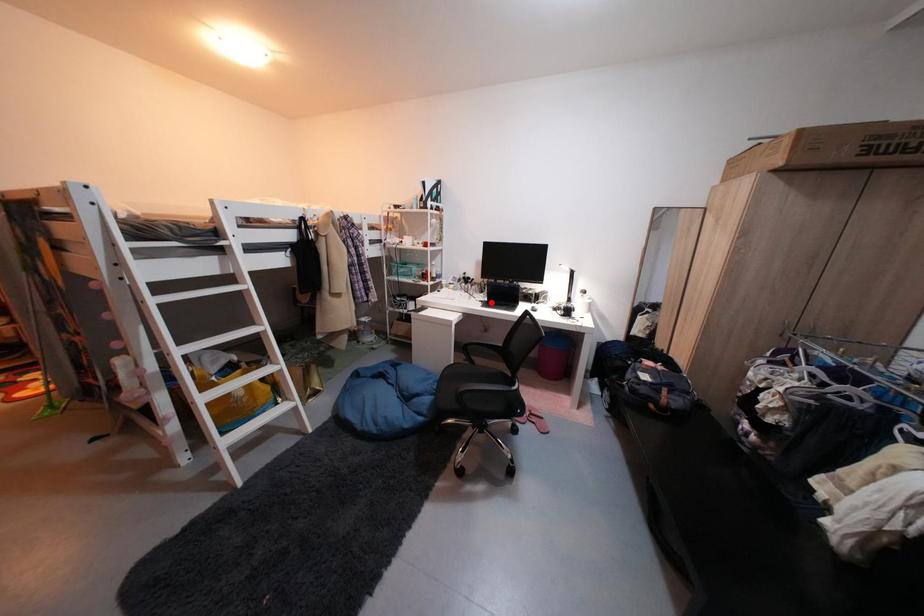
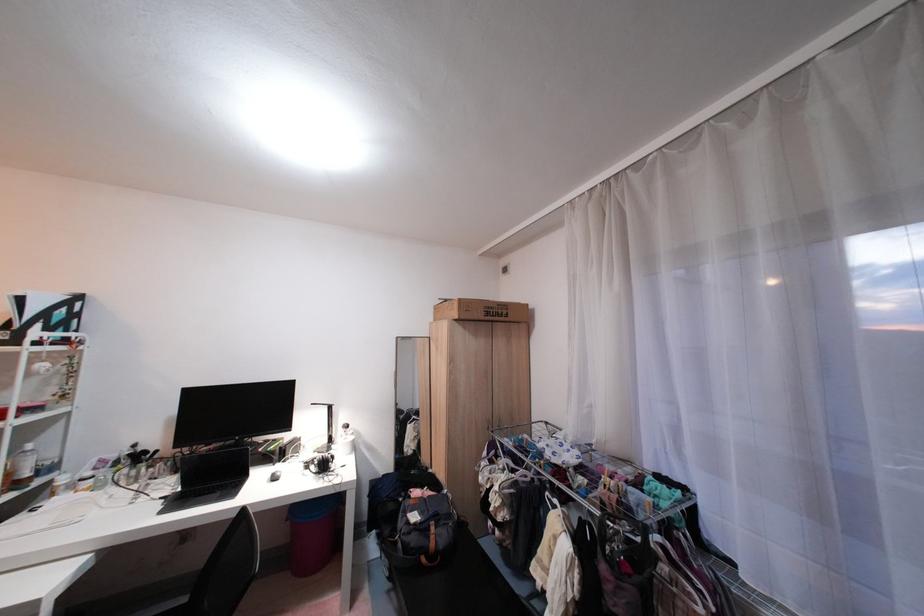
Where in the second image is the point corresponding to the highlighted location from the first image?

(172, 500)